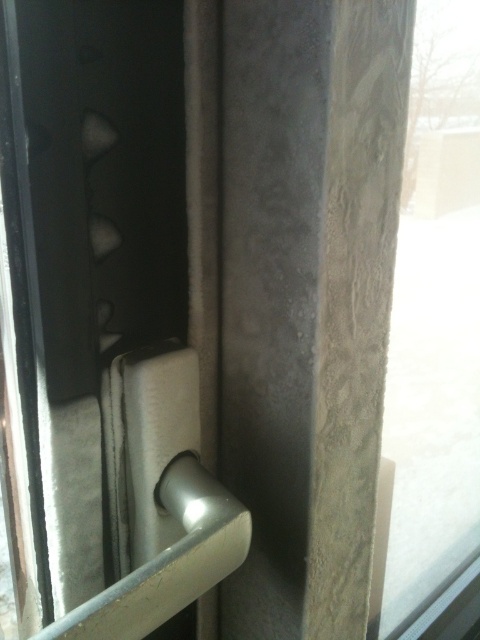
From the picture: Can you confirm if sanded concrete pillar at center is shorter than silver metallic door handle at center?

No.

Measure the distance from sanded concrete pillar at center to silver metallic door handle at center.

sanded concrete pillar at center and silver metallic door handle at center are 6.96 inches apart.

This screenshot has width=480, height=640. I want to click on sanded concrete pillar at center, so click(x=307, y=298).

Locate an element on the screen. Image resolution: width=480 pixels, height=640 pixels. sanded concrete pillar at center is located at coordinates (307, 298).

Does sanded concrete pillar at center have a larger size compared to transparent glass window at right?

No, sanded concrete pillar at center is not bigger than transparent glass window at right.

Can you confirm if sanded concrete pillar at center is shorter than transparent glass window at right?

Correct, sanded concrete pillar at center is not as tall as transparent glass window at right.

Measure the distance between point (324,637) and camera.

A distance of 23.75 inches exists between point (324,637) and camera.

The height and width of the screenshot is (640, 480). In order to click on sanded concrete pillar at center in this screenshot , I will do `click(307, 298)`.

Can you confirm if transparent glass window at right is positioned to the right of silver metallic door handle at center?

Correct, you'll find transparent glass window at right to the right of silver metallic door handle at center.

Between transparent glass window at right and silver metallic door handle at center, which one appears on the left side from the viewer's perspective?

silver metallic door handle at center

Does point (454, 51) come farther from viewer compared to point (100, 625)?

Yes, point (454, 51) is farther from viewer.

Find the location of `transparent glass window at right`. transparent glass window at right is located at coordinates (434, 323).